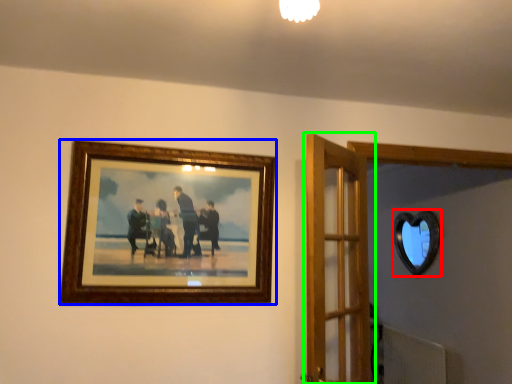
Question: Based on their relative distances, which object is nearer to mirror (highlighted by a red box)? Choose from picture frame (highlighted by a blue box) and door (highlighted by a green box).

Choices:
 (A) picture frame
 (B) door

Answer: (B)